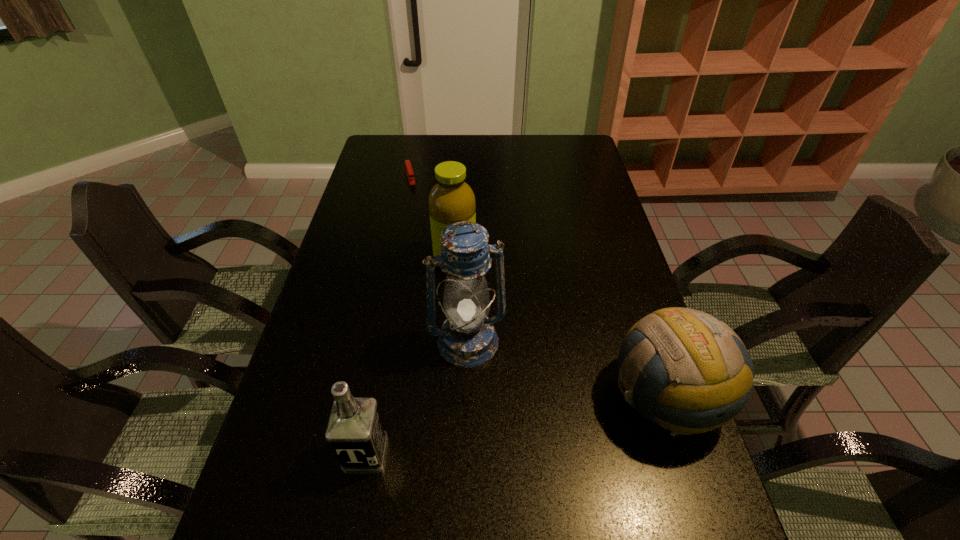
Identify the location of vodka. (355, 431).

You are a GUI agent. You are given a task and a screenshot of the screen. Output one action in this format:
    pyautogui.click(x=<x>, y=<y>)
    Task: Click on the volleyball
    
    Given the screenshot: What is the action you would take?
    pyautogui.click(x=699, y=368)

Locate an element on the screen. This screenshot has height=540, width=960. the fourth shortest object is located at coordinates (451, 199).

I want to click on the second farthest object, so click(x=451, y=199).

The image size is (960, 540). Find the location of `stapler`. stapler is located at coordinates (409, 171).

The height and width of the screenshot is (540, 960). Find the location of `the shortest object`. the shortest object is located at coordinates (409, 171).

The height and width of the screenshot is (540, 960). Identify the location of lantern. (467, 339).

The width and height of the screenshot is (960, 540). Find the location of `vacant space located on the front label of the vodka`. vacant space located on the front label of the vodka is located at coordinates (357, 500).

The image size is (960, 540). I want to click on free space located 0.250m on the left of the rightmost object, so click(501, 396).

The image size is (960, 540). Find the location of `free space located 0.330m on the front label of the fruit juice`. free space located 0.330m on the front label of the fruit juice is located at coordinates (500, 365).